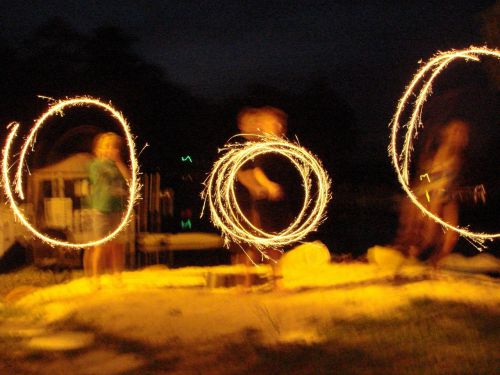
Identify the location of light. (397, 141).